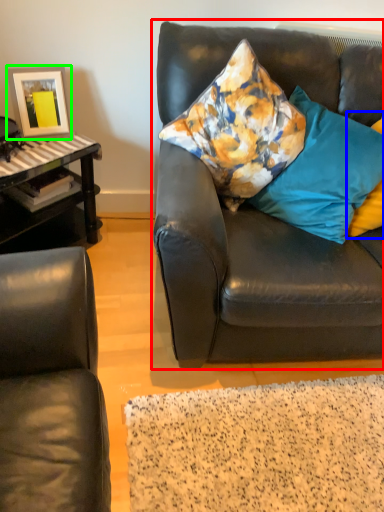
Question: Estimate the real-world distances between objects in this image. Which object is farther from studio couch (highlighted by a red box), pillow (highlighted by a blue box) or picture frame (highlighted by a green box)?

Choices:
 (A) pillow
 (B) picture frame

Answer: (B)